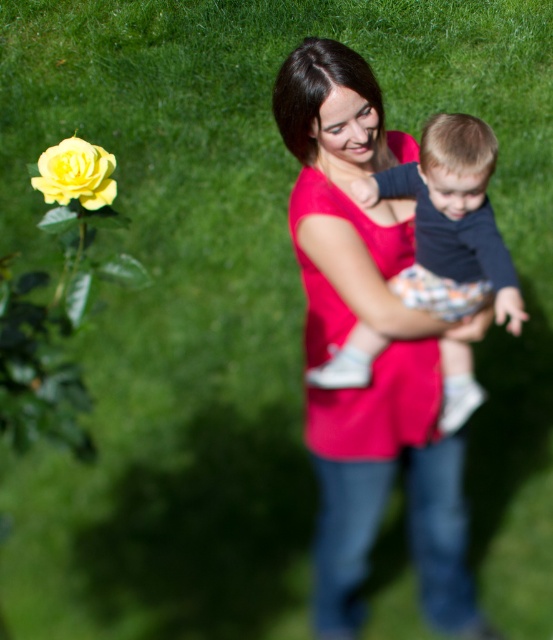
Can you confirm if matte pink shirt at center is shorter than yellow matte rose at lower left?

In fact, matte pink shirt at center may be taller than yellow matte rose at lower left.

Can you confirm if matte pink shirt at center is smaller than yellow matte rose at lower left?

Incorrect, matte pink shirt at center is not smaller in size than yellow matte rose at lower left.

The height and width of the screenshot is (640, 553). What are the coordinates of `matte pink shirt at center` in the screenshot? It's located at (375, 358).

Can you confirm if matte pink shirt at center is positioned to the left of dark blue cotton shirt at center?

Yes, matte pink shirt at center is to the left of dark blue cotton shirt at center.

Locate an element on the screen. The width and height of the screenshot is (553, 640). matte pink shirt at center is located at coordinates (375, 358).

Where is `matte pink shirt at center`? Image resolution: width=553 pixels, height=640 pixels. matte pink shirt at center is located at coordinates pos(375,358).

Measure the distance between dark blue cotton shirt at center and yellow matte rose at lower left.

They are 3.52 feet apart.

Who is higher up, dark blue cotton shirt at center or yellow matte rose at lower left?

yellow matte rose at lower left is above.

Is point (483, 241) closer to viewer compared to point (114, 157)?

Yes, it is in front of point (114, 157).

Image resolution: width=553 pixels, height=640 pixels. In order to click on dark blue cotton shirt at center in this screenshot , I will do `click(451, 224)`.